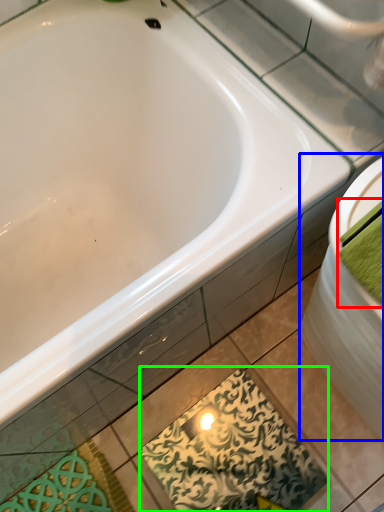
Question: Considering the real-world distances, which object is farthest from bath towel (highlighted by a red box)? sink (highlighted by a blue box) or design (highlighted by a green box)?

Choices:
 (A) sink
 (B) design

Answer: (B)